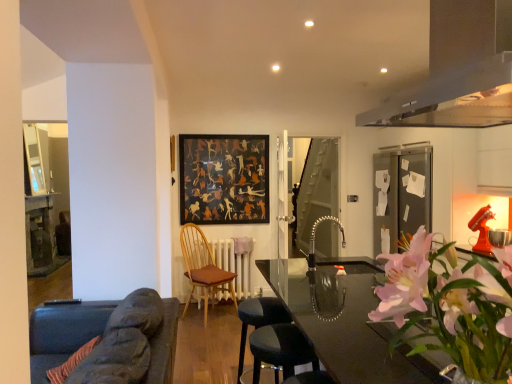
Question: Considering the positions of transparent glass table at center, marked as the first table in a right-to-left arrangement, and white painted radiator at center in the image, is transparent glass table at center, marked as the first table in a right-to-left arrangement, taller or shorter than white painted radiator at center?

Choices:
 (A) tall
 (B) short

Answer: (A)

Question: Is transparent glass table at center, the 2th table viewed from the left, bigger or smaller than white painted radiator at center?

Choices:
 (A) big
 (B) small

Answer: (A)

Question: Which of these objects is positioned closest to the wooden table at left, the first table positioned from the left?

Choices:
 (A) black matte picture frame at center
 (B) satin black exhaust hood at upper right
 (C) dark gray fabric bar stool at lower center, arranged as the 1th bar stool when viewed from the front
 (D) pink floral arrangement at right
 (E) wooden chair with brown cushion at center

Answer: (E)

Question: Which of these objects is positioned farthest from the black matte picture frame at center?

Choices:
 (A) transparent glass table at center, the 2th table viewed from the left
 (B) transparent glass door at center
 (C) wooden chair with brown cushion at center
 (D) pink floral arrangement at right
 (E) dark gray fabric bar stool at lower center, arranged as the 1th bar stool when viewed from the front

Answer: (D)